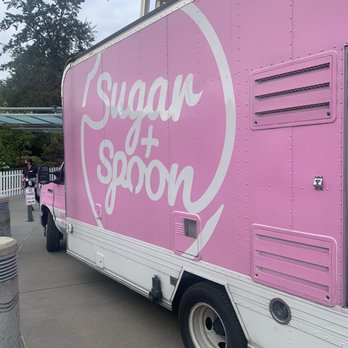
Image resolution: width=348 pixels, height=348 pixels. In order to click on air vents in this screenshot , I will do `click(276, 259)`, `click(299, 94)`.